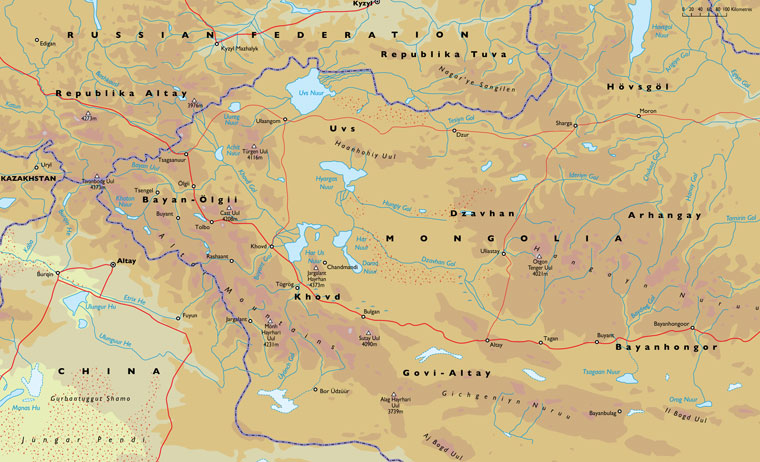
Locate an element on the screen. This screenshot has width=760, height=462. map is located at coordinates (350, 186).